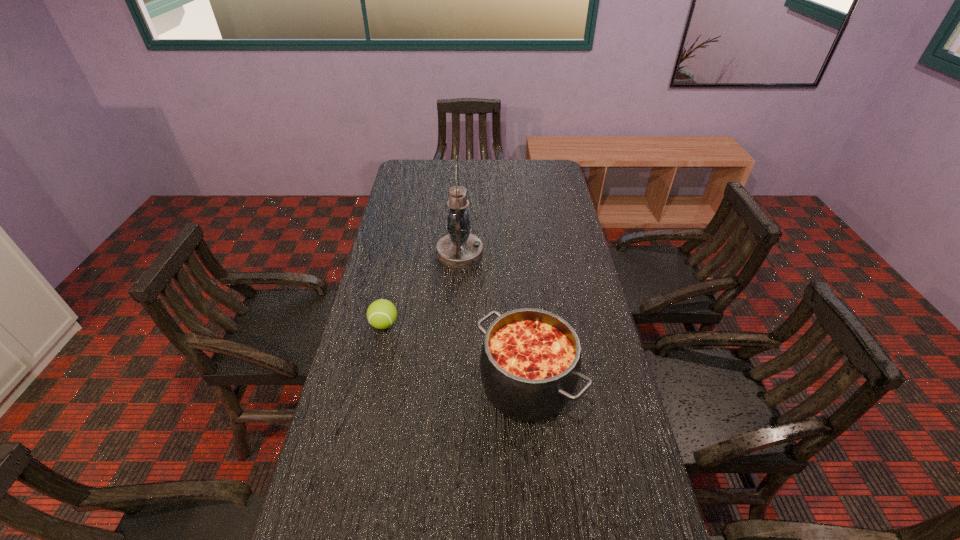
You are a GUI agent. You are given a task and a screenshot of the screen. Output one action in this format:
    pyautogui.click(x=<x>, y=<y>)
    Task: Click on the free region that satisfies the following two spatial constraints: 1. on the front side of the second tallest object; 2. on the right side of the tennis ball
    This screenshot has width=960, height=540.
    Given the screenshot: What is the action you would take?
    pyautogui.click(x=372, y=384)